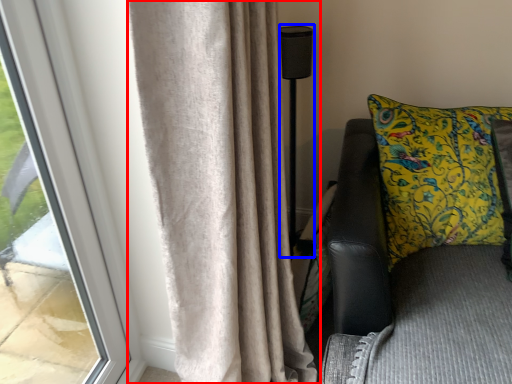
Question: Which of the following is the closest to the observer, curtain (highlighted by a red box) or lamp (highlighted by a blue box)?

Choices:
 (A) curtain
 (B) lamp

Answer: (A)